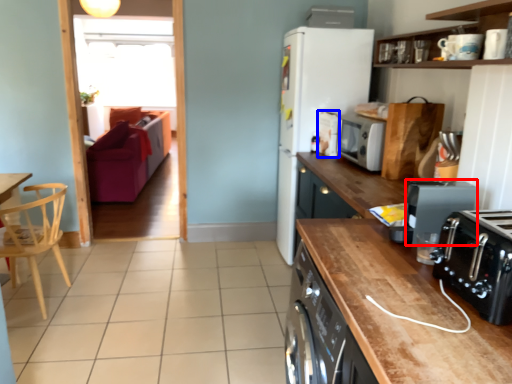
Question: Which point is further to the camera, kitchen appliance (highlighted by a red box) or appliance (highlighted by a blue box)?

Choices:
 (A) kitchen appliance
 (B) appliance

Answer: (B)